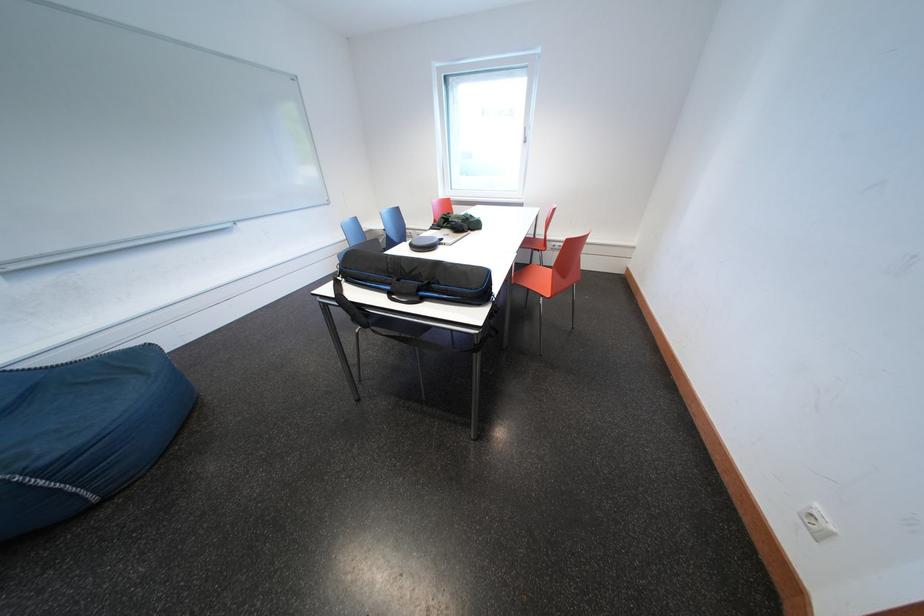
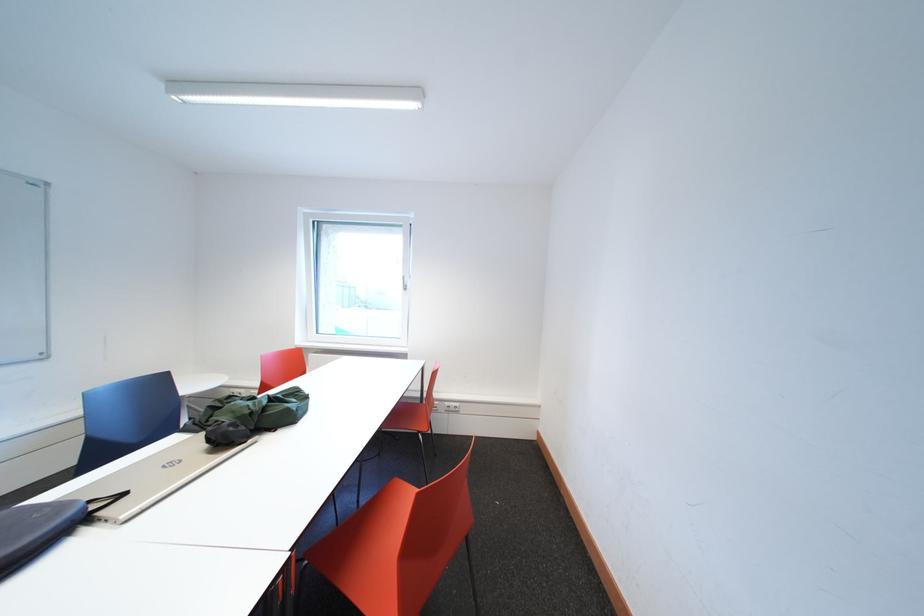
The images are taken continuously from a first-person perspective. In which direction is your viewpoint rotating?

The rotation direction of the camera is right-up.